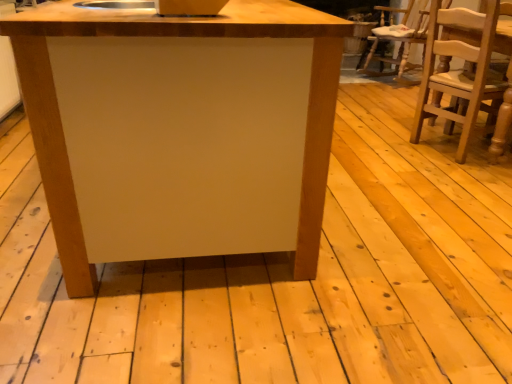
You are a GUI agent. You are given a task and a screenshot of the screen. Output one action in this format:
    pyautogui.click(x=<x>, y=<y>)
    Task: Click on the vacant space to the left of light brown wooden chair at right
    The image size is (512, 384).
    Given the screenshot: What is the action you would take?
    (x=385, y=148)